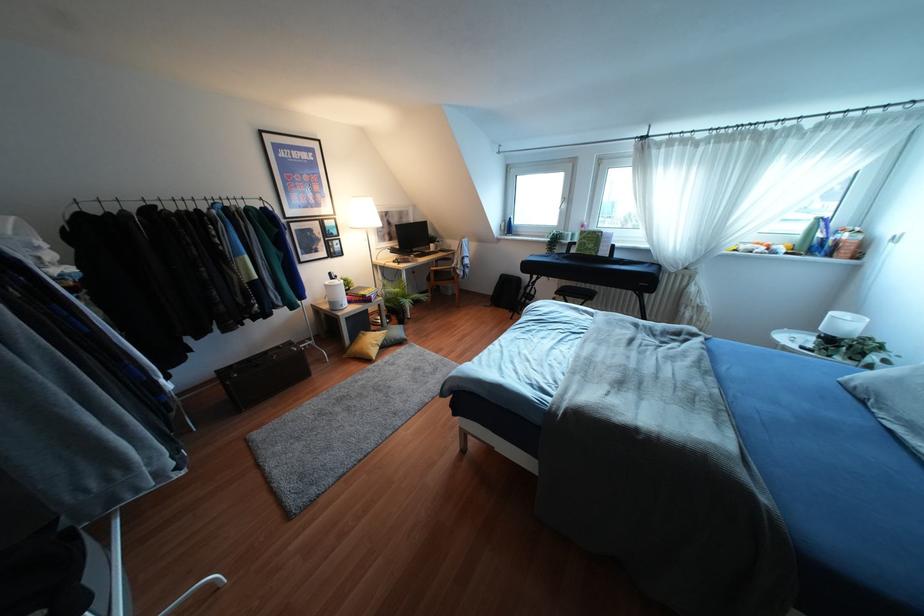
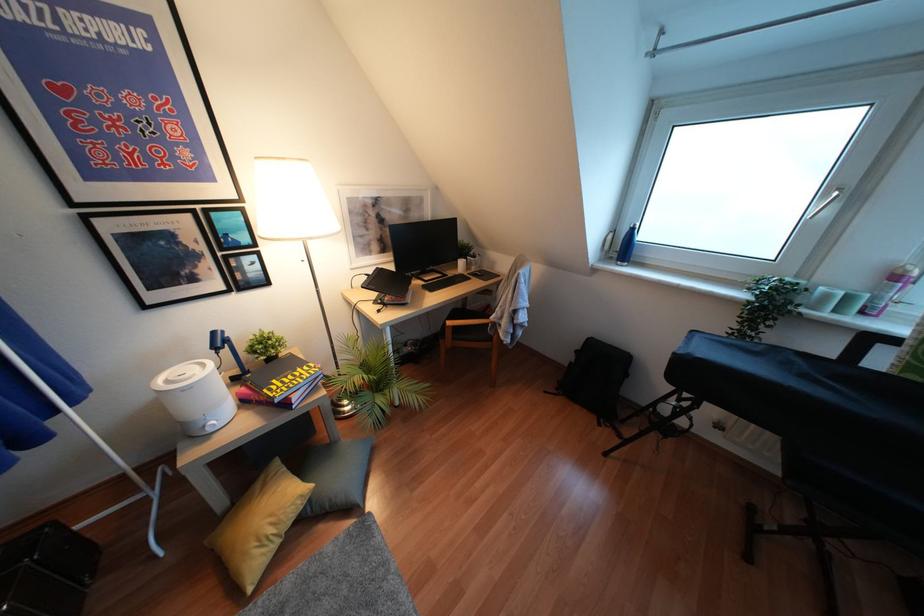
In the second image, find the point that corresponds to (581,225) in the first image.

(895, 277)